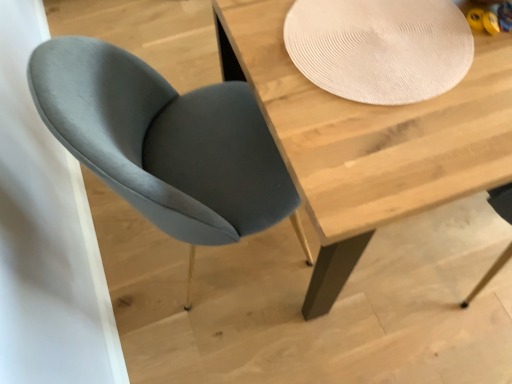
At what (x,y) coordinates should I click in order to perform the action: click on empty space that is ontop of beige textured placemat at upper center (from a real-world perspective). Please return your answer as a coordinate pair (x, y). This screenshot has width=512, height=384. Looking at the image, I should click on (382, 52).